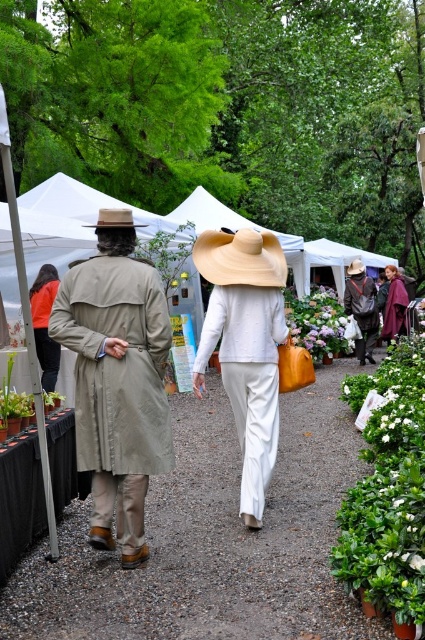
Measure the distance between matte brown hat at center and camera.

They are 4.15 meters apart.

Is matte brown hat at center taller than matte white hat at center?

In fact, matte brown hat at center may be shorter than matte white hat at center.

Is point (320, 512) more distant than point (249, 374)?

That is True.

At what (x,y) coordinates should I click in order to perform the action: click on matte brown hat at center. Please return your answer as a coordinate pair (x, y). The width and height of the screenshot is (425, 640). Looking at the image, I should click on (212, 540).

Which is in front, point (124, 465) or point (359, 291)?

Point (124, 465)

Can you confirm if khaki fabric trench coat at left is wider than brown leather hat at center?

No.

This screenshot has height=640, width=425. Describe the element at coordinates (116, 384) in the screenshot. I see `khaki fabric trench coat at left` at that location.

Find the location of a particular element. khaki fabric trench coat at left is located at coordinates (116, 384).

Does point (87, 400) come closer to viewer compared to point (305, 339)?

Yes, it is in front of point (305, 339).

Can you confirm if khaki fabric trench coat at left is wider than purple fabric flower at center?

No, khaki fabric trench coat at left is not wider than purple fabric flower at center.

Who is more distant from viewer, (78, 410) or (303, 307)?

The point (303, 307) is more distant.

At what (x,y) coordinates should I click in order to perform the action: click on khaki fabric trench coat at left. Please return your answer as a coordinate pair (x, y). The image size is (425, 640). Looking at the image, I should click on (116, 384).